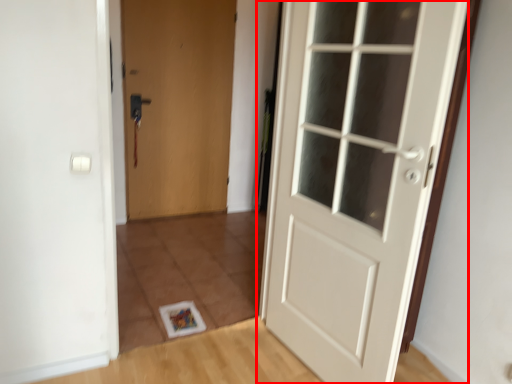
Question: From the image's perspective, where is door (annotated by the red box) located in relation to door in the image?

Choices:
 (A) above
 (B) below

Answer: (B)